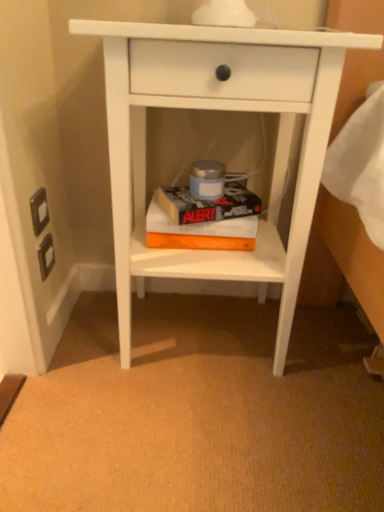
At what (x,y) coordinates should I click in order to perform the action: click on hardcover book at center, which is the 1th paperback book from top to bottom. Please return your answer as a coordinate pair (x, y). The image size is (384, 512). Looking at the image, I should click on (208, 204).

The width and height of the screenshot is (384, 512). In order to click on white matte nightstand at center in this screenshot , I will do `click(216, 110)`.

At what (x,y) coordinates should I click in order to perform the action: click on hardcover book at center, the 2th paperback book ordered from the bottom. Please return your answer as a coordinate pair (x, y). This screenshot has width=384, height=512. Looking at the image, I should click on (208, 204).

Is hardcover book at center, which is the 1th paperback book from top to bottom, aimed at orange matte paperback book at center, which is the first paperback book from bottom to top?

No, hardcover book at center, which is the 1th paperback book from top to bottom, does not turn towards orange matte paperback book at center, which is the first paperback book from bottom to top.

Which object is positioned more to the left, hardcover book at center, which is the 1th paperback book from top to bottom, or orange matte paperback book at center, which is the 2th paperback book from top to bottom?

orange matte paperback book at center, which is the 2th paperback book from top to bottom.

Would you say orange matte paperback book at center, which is the first paperback book from bottom to top, is part of hardcover book at center, the 2th paperback book ordered from the bottom,'s contents?

No, orange matte paperback book at center, which is the first paperback book from bottom to top, is not a part of hardcover book at center, the 2th paperback book ordered from the bottom.

Is white matte nightstand at center touching orange matte paperback book at center, which is the 2th paperback book from top to bottom?

They are not placed beside each other.

From a real-world perspective, is white matte nightstand at center physically above orange matte paperback book at center, which is the 2th paperback book from top to bottom?

Indeed, from a real-world perspective, white matte nightstand at center stands above orange matte paperback book at center, which is the 2th paperback book from top to bottom.

Between white matte nightstand at center and orange matte paperback book at center, which is the 2th paperback book from top to bottom, which one has smaller width?

orange matte paperback book at center, which is the 2th paperback book from top to bottom.

Is orange matte paperback book at center, which is the first paperback book from bottom to top, completely or partially outside of hardcover book at center, which is the 1th paperback book from top to bottom?

Yes.

Is orange matte paperback book at center, which is the first paperback book from bottom to top, to the left of hardcover book at center, which is the 1th paperback book from top to bottom, from the viewer's perspective?

Correct, you'll find orange matte paperback book at center, which is the first paperback book from bottom to top, to the left of hardcover book at center, which is the 1th paperback book from top to bottom.

Between orange matte paperback book at center, which is the 2th paperback book from top to bottom, and hardcover book at center, which is the 1th paperback book from top to bottom, which one has more height?

With more height is orange matte paperback book at center, which is the 2th paperback book from top to bottom.

From a real-world perspective, is orange matte paperback book at center, which is the 2th paperback book from top to bottom, on top of hardcover book at center, which is the 1th paperback book from top to bottom?

Incorrect, from a real-world perspective, orange matte paperback book at center, which is the 2th paperback book from top to bottom, is lower than hardcover book at center, which is the 1th paperback book from top to bottom.

Considering the relative positions of white matte nightstand at center and hardcover book at center, the 2th paperback book ordered from the bottom, in the image provided, is white matte nightstand at center behind hardcover book at center, the 2th paperback book ordered from the bottom,?

That is False.

Based on their sizes in the image, would you say white matte nightstand at center is bigger or smaller than hardcover book at center, the 2th paperback book ordered from the bottom?

In the image, white matte nightstand at center appears to be larger than hardcover book at center, the 2th paperback book ordered from the bottom.

Which object is thinner, white matte nightstand at center or hardcover book at center, the 2th paperback book ordered from the bottom?

With smaller width is hardcover book at center, the 2th paperback book ordered from the bottom.

From a real-world perspective, is orange matte paperback book at center, which is the first paperback book from bottom to top, positioned under white matte nightstand at center based on gravity?

Yes, from a real-world perspective, orange matte paperback book at center, which is the first paperback book from bottom to top, is beneath white matte nightstand at center.

Is orange matte paperback book at center, which is the 2th paperback book from top to bottom, to the left or to the right of white matte nightstand at center in the image?

In the image, orange matte paperback book at center, which is the 2th paperback book from top to bottom, appears on the left side of white matte nightstand at center.

Is orange matte paperback book at center, which is the first paperback book from bottom to top, inside or outside of white matte nightstand at center?

orange matte paperback book at center, which is the first paperback book from bottom to top, fits inside white matte nightstand at center.

Considering the sizes of orange matte paperback book at center, which is the first paperback book from bottom to top, and white matte nightstand at center in the image, is orange matte paperback book at center, which is the first paperback book from bottom to top, wider or thinner than white matte nightstand at center?

orange matte paperback book at center, which is the first paperback book from bottom to top, is thinner than white matte nightstand at center.

Considering the positions of point (194, 220) and point (143, 37), is point (194, 220) closer or farther from the camera than point (143, 37)?

Point (194, 220) is positioned farther from the camera compared to point (143, 37).

Would you say hardcover book at center, the 2th paperback book ordered from the bottom, is inside or outside white matte nightstand at center?

hardcover book at center, the 2th paperback book ordered from the bottom, is contained in white matte nightstand at center.

From the image's perspective, between hardcover book at center, the 2th paperback book ordered from the bottom, and white matte nightstand at center, who is located below?

white matte nightstand at center, from the image's perspective.

Can you confirm if hardcover book at center, the 2th paperback book ordered from the bottom, is shorter than white matte nightstand at center?

Yes.

This screenshot has width=384, height=512. Find the location of `paperback book behind the hardcover book at center, the 2th paperback book ordered from the bottom`. paperback book behind the hardcover book at center, the 2th paperback book ordered from the bottom is located at coordinates (198, 231).

At what (x,y) coordinates should I click in order to perform the action: click on paperback book located below the white matte nightstand at center (from the image's perspective). Please return your answer as a coordinate pair (x, y). The width and height of the screenshot is (384, 512). Looking at the image, I should click on (198, 231).

Considering their positions, is hardcover book at center, the 2th paperback book ordered from the bottom, positioned further to white matte nightstand at center than orange matte paperback book at center, which is the first paperback book from bottom to top?

hardcover book at center, the 2th paperback book ordered from the bottom, is further to white matte nightstand at center.

When comparing their distances from orange matte paperback book at center, which is the 2th paperback book from top to bottom, does hardcover book at center, the 2th paperback book ordered from the bottom, or white matte nightstand at center seem further?

white matte nightstand at center lies further to orange matte paperback book at center, which is the 2th paperback book from top to bottom, than the other object.

From the image, which object appears to be nearer to white matte nightstand at center, orange matte paperback book at center, which is the 2th paperback book from top to bottom, or hardcover book at center, which is the 1th paperback book from top to bottom?

Among the two, orange matte paperback book at center, which is the 2th paperback book from top to bottom, is located nearer to white matte nightstand at center.

Considering their positions, is white matte nightstand at center positioned closer to orange matte paperback book at center, which is the first paperback book from bottom to top, than hardcover book at center, which is the 1th paperback book from top to bottom?

hardcover book at center, which is the 1th paperback book from top to bottom.

From the image, which object appears to be nearer to hardcover book at center, which is the 1th paperback book from top to bottom, orange matte paperback book at center, which is the first paperback book from bottom to top, or white matte nightstand at center?

Among the two, orange matte paperback book at center, which is the first paperback book from bottom to top, is located nearer to hardcover book at center, which is the 1th paperback book from top to bottom.

Based on their spatial positions, is white matte nightstand at center or orange matte paperback book at center, which is the 2th paperback book from top to bottom, closer to hardcover book at center, which is the 1th paperback book from top to bottom?

orange matte paperback book at center, which is the 2th paperback book from top to bottom, lies closer to hardcover book at center, which is the 1th paperback book from top to bottom, than the other object.

You are a GUI agent. You are given a task and a screenshot of the screen. Output one action in this format:
    pyautogui.click(x=<x>, y=<y>)
    Task: Click on the paperback book between white matte nightstand at center and orange matte paperback book at center, which is the first paperback book from bottom to top, in the front-back direction
    
    Given the screenshot: What is the action you would take?
    pyautogui.click(x=208, y=204)